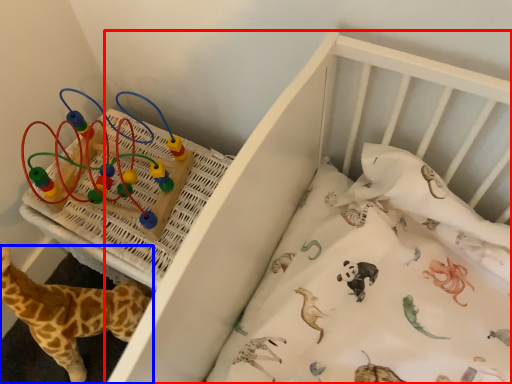
Question: Which point is further to the camera, infant bed (highlighted by a red box) or giraffe (highlighted by a blue box)?

Choices:
 (A) infant bed
 (B) giraffe

Answer: (B)